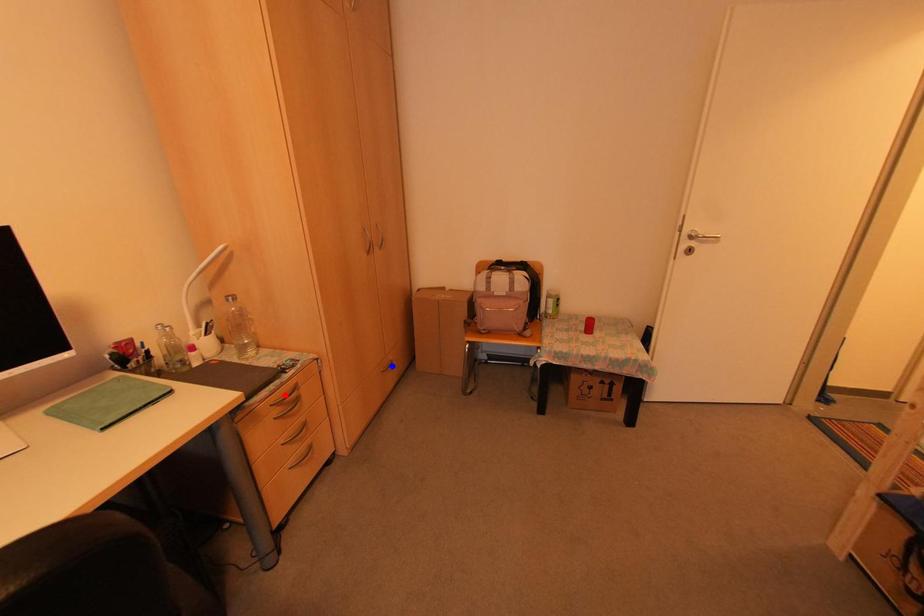
Question: Two points are marked on the image. Which point is closer to the camera?

Choices:
 (A) Blue point is closer.
 (B) Red point is closer.

Answer: (B)